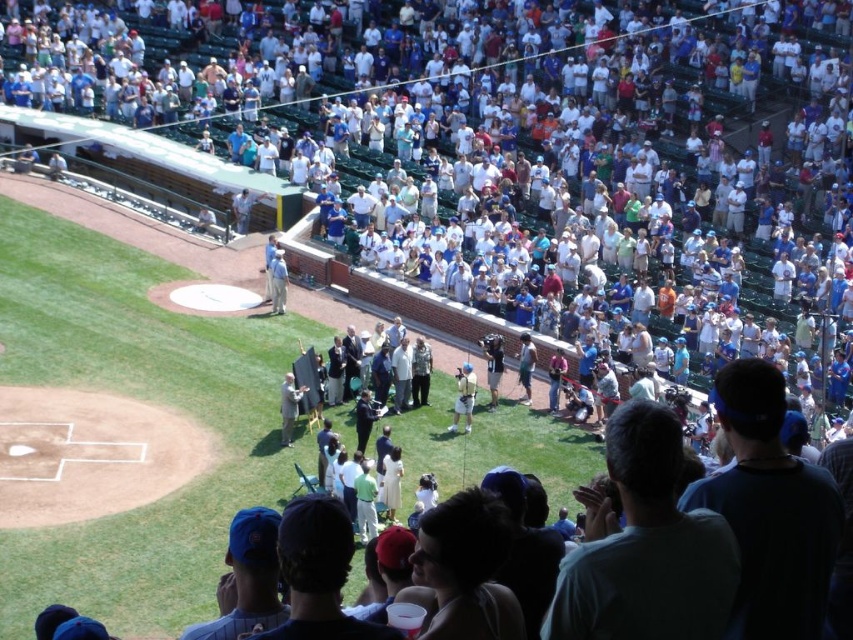
Measure the distance from white jersey at center to light gray fabric jacket at center.

white jersey at center and light gray fabric jacket at center are 16.80 feet apart.

Does white jersey at center have a larger size compared to light gray fabric jacket at center?

No, white jersey at center is not bigger than light gray fabric jacket at center.

Who is more forward, [462,378] or [282,422]?

Point [282,422]

Where is `white jersey at center`? white jersey at center is located at coordinates (463, 396).

Describe the element at coordinates (463, 396) in the screenshot. I see `white jersey at center` at that location.

Consider the image. Does white jersey at center have a smaller size compared to white cotton shirt at center?

Indeed, white jersey at center has a smaller size compared to white cotton shirt at center.

Identify the location of white jersey at center. (463, 396).

Does light gray fabric jacket at center appear on the right side of white cotton shirt at center?

Correct, you'll find light gray fabric jacket at center to the right of white cotton shirt at center.

Which is behind, point (289, 381) or point (277, 300)?

The point (277, 300) is behind.

Is point (286, 380) positioned behind point (283, 312)?

No, (286, 380) is closer to viewer.

Where is `light gray fabric jacket at center`? This screenshot has height=640, width=853. light gray fabric jacket at center is located at coordinates (289, 406).